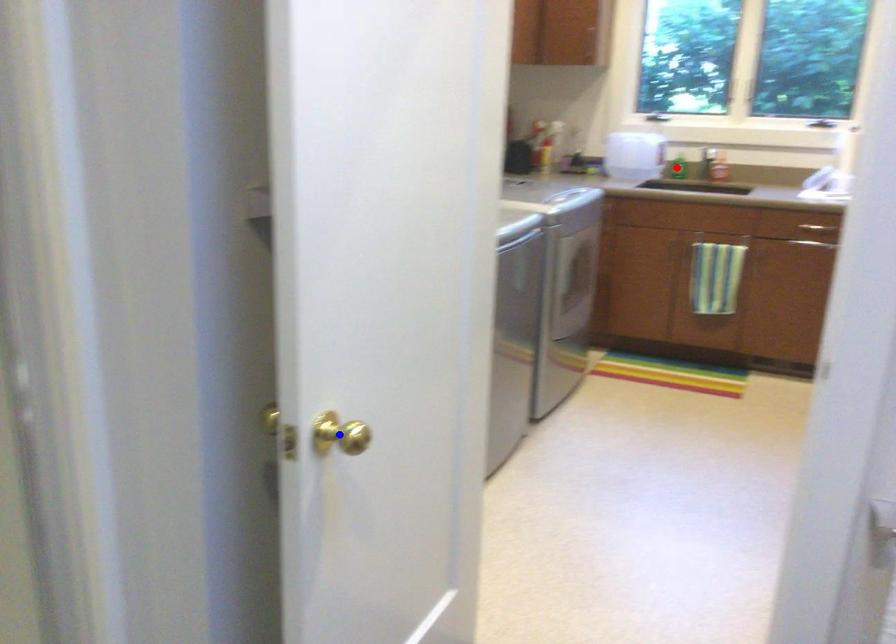
Question: Which of the two points in the image is closer to the camera?

Choices:
 (A) Blue point is closer.
 (B) Red point is closer.

Answer: (A)